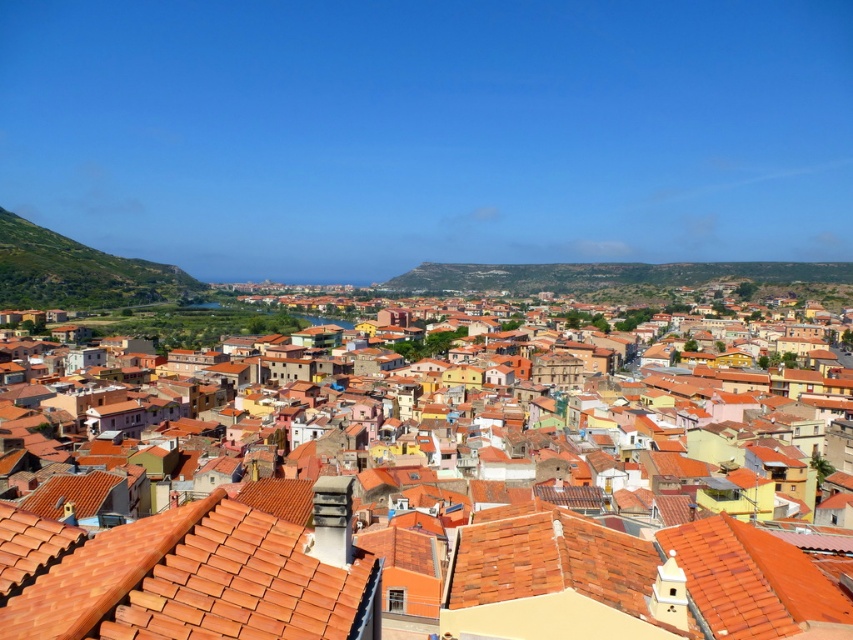
Question: Does terracotta tiles at center come behind terracotta tiles at lower left?

Choices:
 (A) no
 (B) yes

Answer: (A)

Question: Among these objects, which one is farthest from the camera?

Choices:
 (A) terracotta tiles at lower left
 (B) terracotta tiles at center

Answer: (A)

Question: Does terracotta tiles at center appear on the right side of terracotta tiles at lower left?

Choices:
 (A) no
 (B) yes

Answer: (B)

Question: Does terracotta tiles at center have a larger size compared to terracotta tiles at lower left?

Choices:
 (A) no
 (B) yes

Answer: (B)